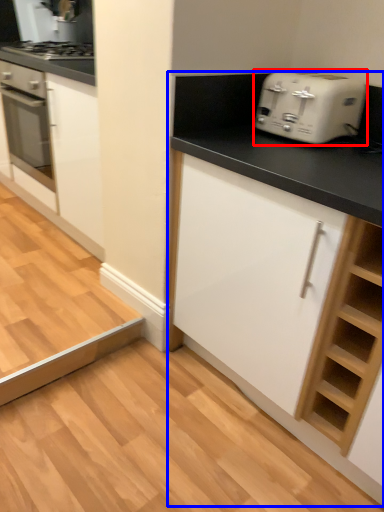
Question: Among these objects, which one is farthest to the camera, toaster (highlighted by a red box) or cabinetry (highlighted by a blue box)?

Choices:
 (A) toaster
 (B) cabinetry

Answer: (A)